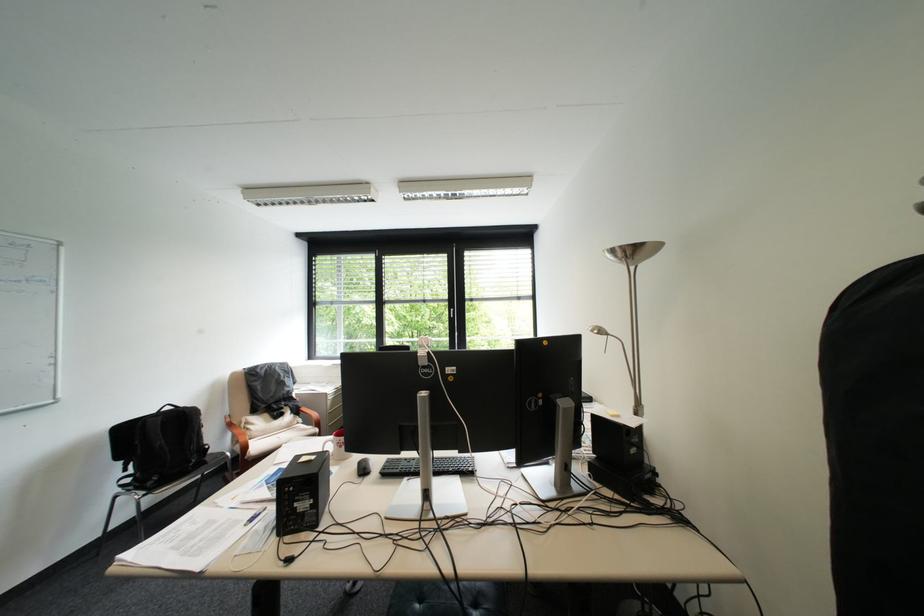
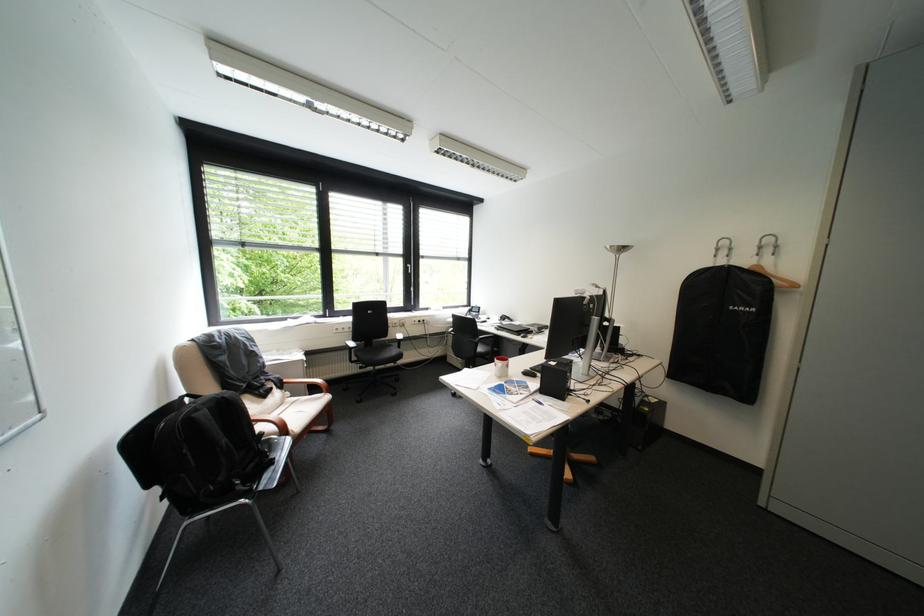
In the second image, find the point that corresponds to the point at 281,423 in the first image.

(272, 403)